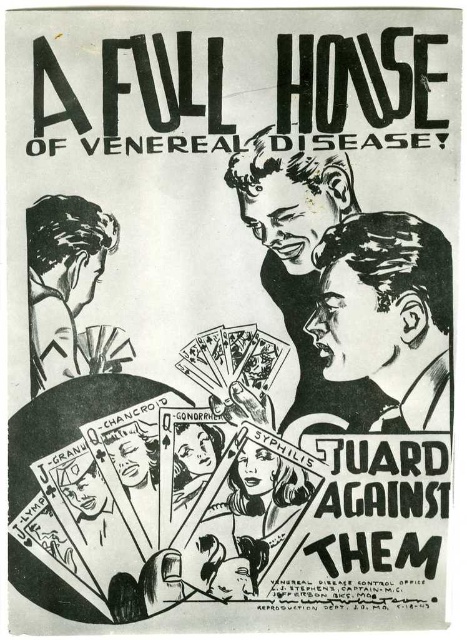
Question: Does smooth black face at lower right appear on the right side of black ink drawing of man at center?

Choices:
 (A) yes
 (B) no

Answer: (A)

Question: Is the position of smooth black face at lower right less distant than that of black ink drawing of man at center?

Choices:
 (A) no
 (B) yes

Answer: (A)

Question: Which of the following is the farthest from the observer?

Choices:
 (A) (270, 177)
 (B) (418, 308)
 (C) (70, 243)

Answer: (B)

Question: Which point is closer to the camera taking this photo?

Choices:
 (A) (70, 305)
 (B) (292, 417)

Answer: (A)

Question: Is black ink drawing of man at center thinner than smooth black hair at left?

Choices:
 (A) yes
 (B) no

Answer: (B)

Question: Which is nearer to the black ink drawing of man at center?

Choices:
 (A) smooth black face at lower right
 (B) smooth black hair at left

Answer: (A)